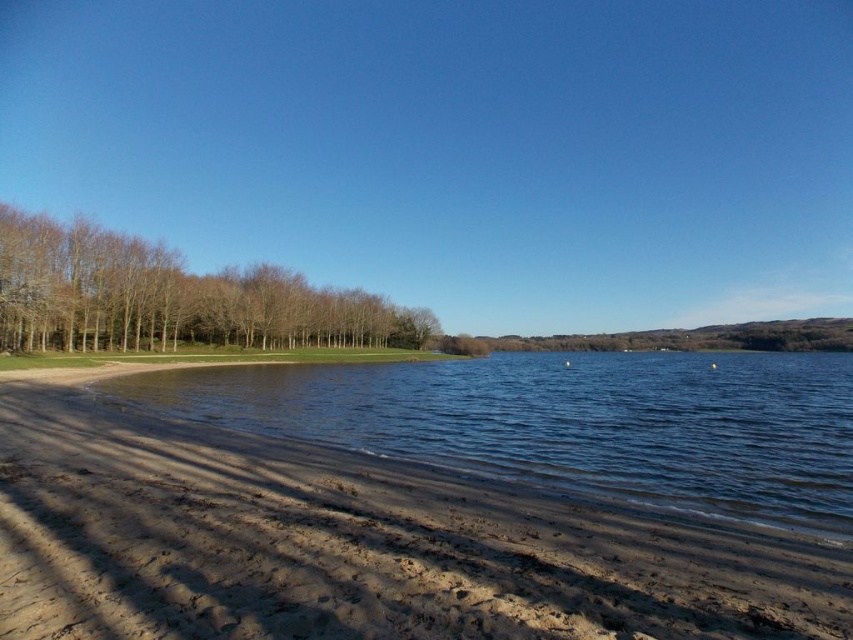
Between dark brown sand at lower left and brown leafless trees at left, which one appears on the right side from the viewer's perspective?

Positioned to the right is dark brown sand at lower left.

Based on the photo, who is positioned more to the left, dark brown sand at lower left or brown leafless trees at left?

From the viewer's perspective, brown leafless trees at left appears more on the left side.

Is point (351, 548) positioned after point (233, 288)?

No, it is not.

Where is `dark brown sand at lower left`? dark brown sand at lower left is located at coordinates (354, 545).